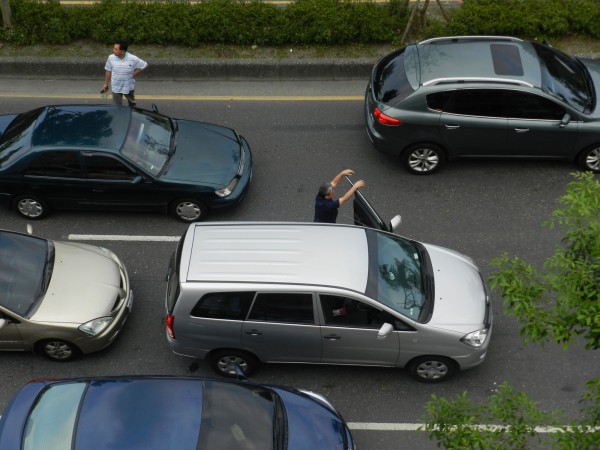
The height and width of the screenshot is (450, 600). What are the coordinates of `hoods` in the screenshot? It's located at (210, 152), (87, 287), (308, 418), (451, 287), (594, 70).